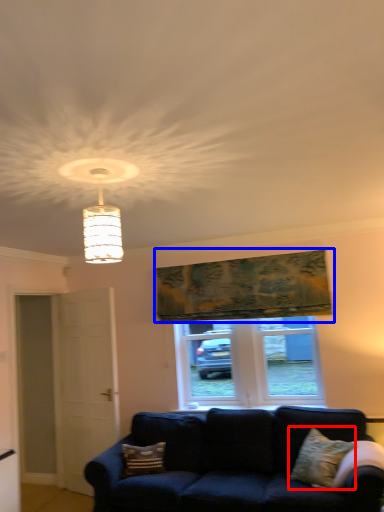
Question: Which object appears farthest to the camera in this image, pillow (highlighted by a red box) or tapestry (highlighted by a blue box)?

Choices:
 (A) pillow
 (B) tapestry

Answer: (B)